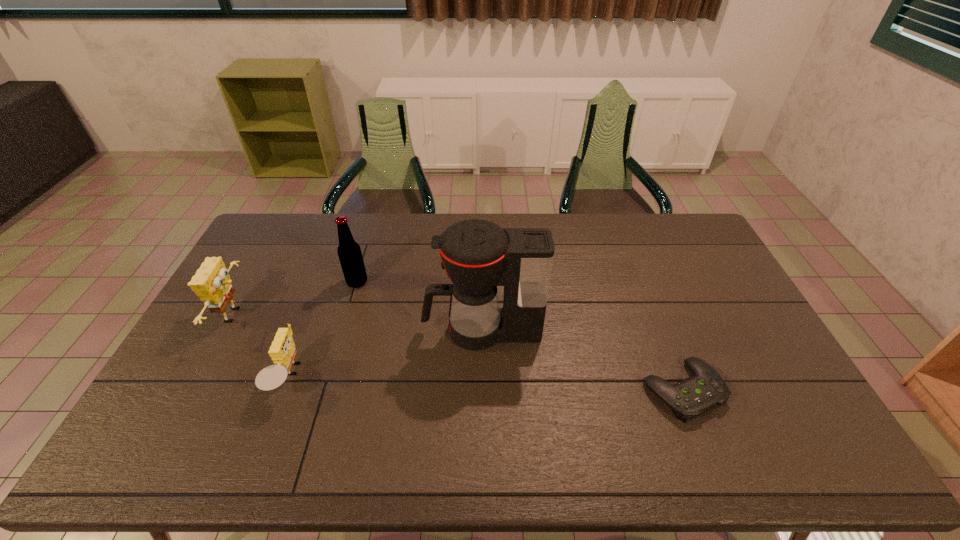
In the image, there is a desktop. Where is `vacant space at the left edge`? vacant space at the left edge is located at coordinates (220, 365).

Where is `free region at the right edge of the desktop`? free region at the right edge of the desktop is located at coordinates (708, 285).

You are a GUI agent. You are given a task and a screenshot of the screen. Output one action in this format:
    pyautogui.click(x=<x>, y=<y>)
    Task: Click on the vacant area at the far left corner of the desktop
    The width and height of the screenshot is (960, 540).
    Given the screenshot: What is the action you would take?
    pyautogui.click(x=293, y=226)

In the image, there is a desktop. At what (x,y) coordinates should I click in order to perform the action: click on vacant space at the far right corner. Please return your answer as a coordinate pair (x, y). Looking at the image, I should click on (695, 241).

Locate an element on the screen. The image size is (960, 540). free point between the tallest object and the rightmost object is located at coordinates (582, 360).

Locate an element on the screen. Image resolution: width=960 pixels, height=540 pixels. unoccupied area between the coffee maker and the shorter sponge is located at coordinates (385, 354).

Find the location of a particular element. The height and width of the screenshot is (540, 960). empty space between the third tallest object and the control is located at coordinates (459, 353).

Identify the location of vacant region between the coffee maker and the rightmost object. (582, 360).

Image resolution: width=960 pixels, height=540 pixels. Identify the location of empty space between the coffee maker and the right sponge. (385, 354).

Where is `free point between the right sponge and the coffee maker`? Image resolution: width=960 pixels, height=540 pixels. free point between the right sponge and the coffee maker is located at coordinates (385, 354).